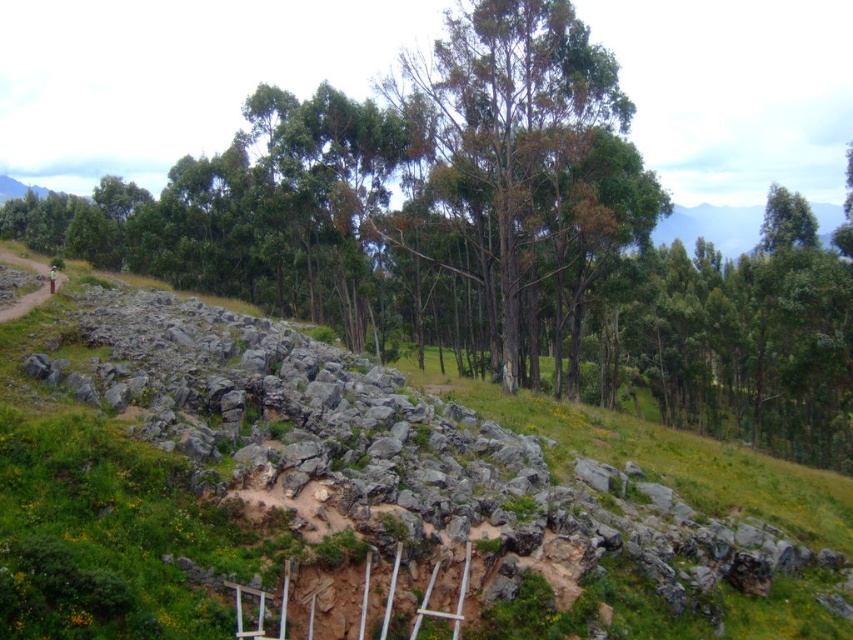
You are hiking on a trail and come across a slope with a gray rock wall at center and a green leafy tree at center. Which object is positioned lower on the slope?

The gray rock wall at center is below the green leafy tree at center, so the gray rock wall at center is positioned lower on the slope.

You are standing at the origin point of the coordinate system in the image. You want to reach the gray rock wall at center. What are the coordinates you need to move towards?

The coordinates you need to move towards are 0.777 in the x direction and 0.401 in the y direction.